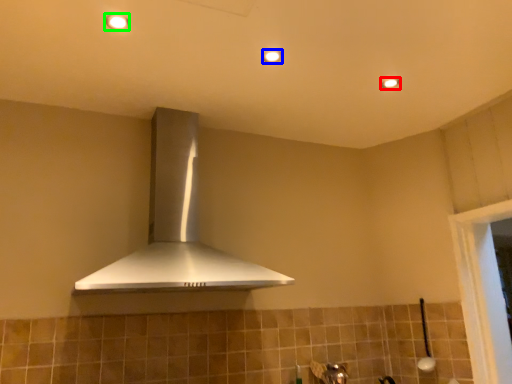
Question: Estimate the real-world distances between objects in this image. Which object is farther from light fixture (highlighted by a red box), light fixture (highlighted by a blue box) or light fixture (highlighted by a green box)?

Choices:
 (A) light fixture
 (B) light fixture

Answer: (B)